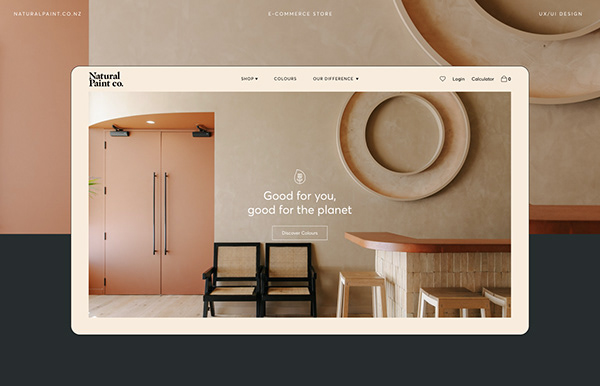
Locate an element on the screen. Image resolution: width=600 pixels, height=386 pixels. left chair is located at coordinates (233, 269).